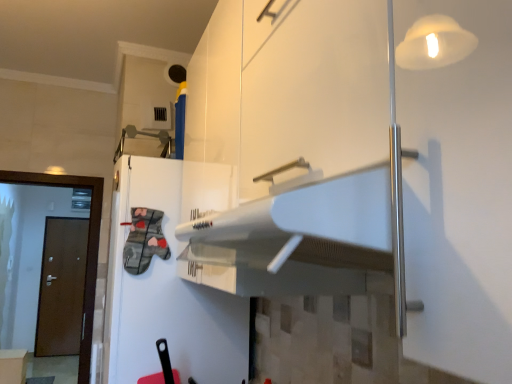
Question: Does brown wooden door at left, which is counted as the second door, starting from the front, have a greater height compared to white glossy cabinet at lower left, positioned as the first cabinetry in back-to-front order?

Choices:
 (A) no
 (B) yes

Answer: (B)

Question: Would you say brown wooden door at left, the 1th door when ordered from left to right, is a long distance from white glossy cabinet at lower left, which appears as the first cabinetry when viewed from the left?

Choices:
 (A) yes
 (B) no

Answer: (A)

Question: From a real-world perspective, does brown wooden door at left, which is counted as the second door, starting from the front, sit lower than white glossy cabinet at lower left, which ranks as the 2th cabinetry in top-to-bottom order?

Choices:
 (A) no
 (B) yes

Answer: (A)

Question: Considering the relative sizes of brown wooden door at left, the 2th door from the right, and white glossy cabinet at lower left, positioned as the first cabinetry in back-to-front order, in the image provided, is brown wooden door at left, the 2th door from the right, bigger than white glossy cabinet at lower left, positioned as the first cabinetry in back-to-front order,?

Choices:
 (A) yes
 (B) no

Answer: (A)

Question: From a real-world perspective, is brown wooden door at left, placed as the first door when sorted from back to front, over white glossy cabinet at lower left, which appears as the first cabinetry when viewed from the left?

Choices:
 (A) no
 (B) yes

Answer: (B)

Question: Is brown wooden door at left, the 1th door when ordered from left to right, smaller than white glossy cabinet at lower left, the second cabinetry when ordered from front to back?

Choices:
 (A) no
 (B) yes

Answer: (A)

Question: From the image's perspective, is brown wooden door at left, the 1th door viewed from the right, under white glossy refrigerator at center?

Choices:
 (A) yes
 (B) no

Answer: (A)

Question: Are brown wooden door at left, the second door when ordered from back to front, and white glossy refrigerator at center far apart?

Choices:
 (A) yes
 (B) no

Answer: (A)

Question: From a real-world perspective, does brown wooden door at left, the second door when ordered from back to front, stand above white glossy refrigerator at center?

Choices:
 (A) yes
 (B) no

Answer: (B)

Question: Does brown wooden door at left, acting as the 2th door starting from the left, have a greater width compared to white glossy refrigerator at center?

Choices:
 (A) no
 (B) yes

Answer: (A)

Question: From the image's perspective, would you say brown wooden door at left, the 1th door viewed from the front, is positioned over white glossy refrigerator at center?

Choices:
 (A) no
 (B) yes

Answer: (A)

Question: Does brown wooden door at left, the 1th door viewed from the right, have a larger size compared to white glossy refrigerator at center?

Choices:
 (A) no
 (B) yes

Answer: (A)

Question: From the image's perspective, is brown wooden door at left, which is counted as the second door, starting from the front, under brown wooden door at left, the 1th door viewed from the right?

Choices:
 (A) yes
 (B) no

Answer: (A)